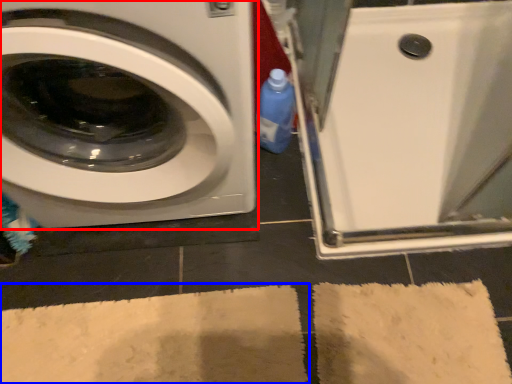
Question: Which of the following is the farthest to the observer, washing machine (highlighted by a red box) or bath mat (highlighted by a blue box)?

Choices:
 (A) washing machine
 (B) bath mat

Answer: (B)